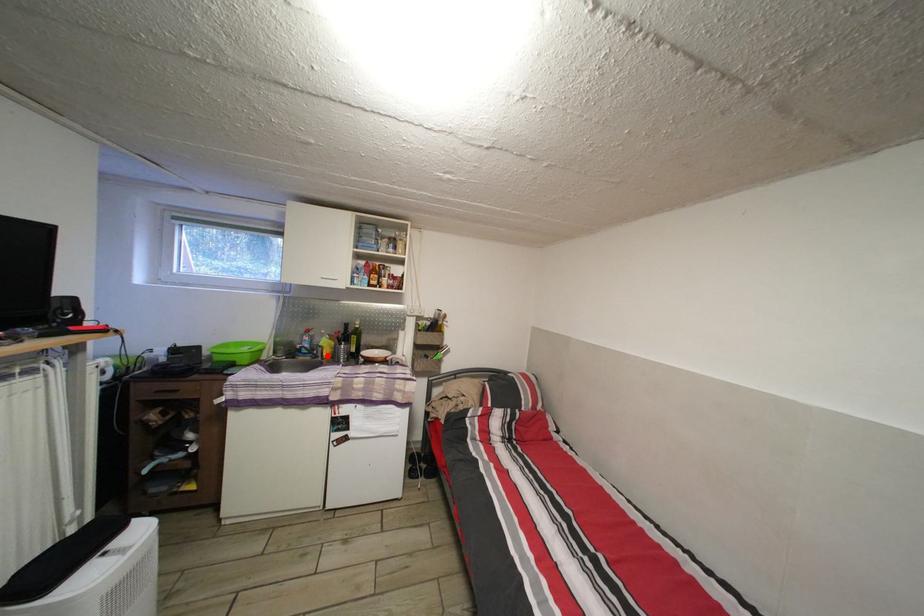
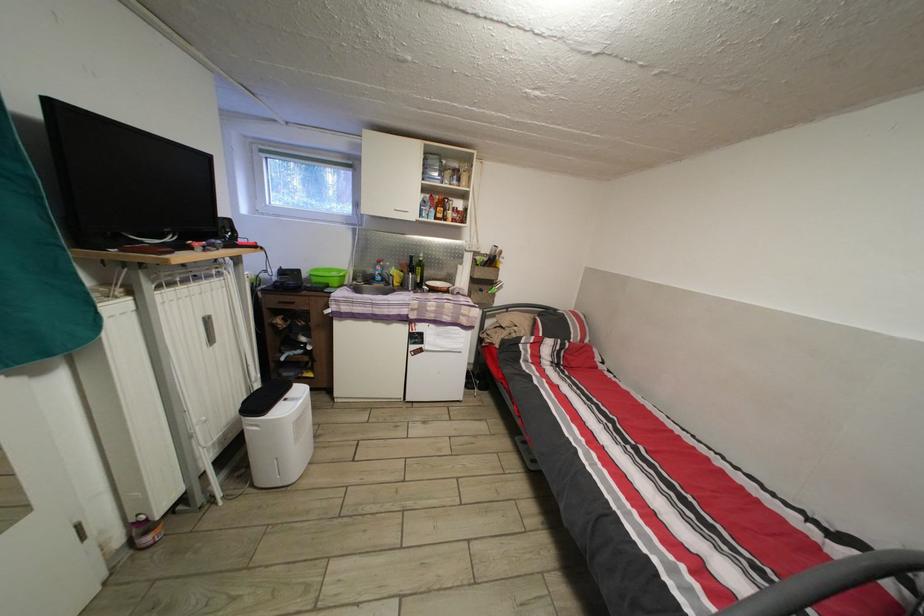
Where in the second image is the point corresponding to the highlighted location from the first image?

(398, 285)